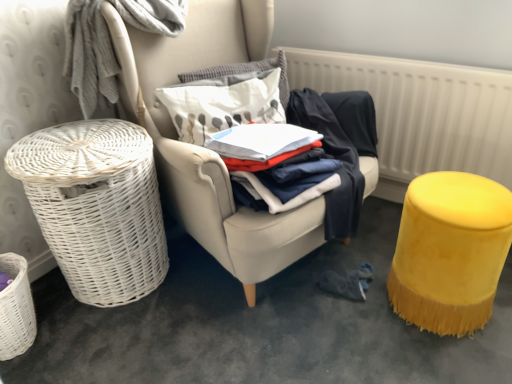
Question: From the image's perspective, does white wicker basket at left appear lower than white fabric pillow at center, arranged as the first pillow when ordered from the bottom?

Choices:
 (A) yes
 (B) no

Answer: (A)

Question: Does white wicker basket at left have a smaller size compared to white fabric pillow at center, arranged as the first pillow when ordered from the bottom?

Choices:
 (A) yes
 (B) no

Answer: (B)

Question: Is white wicker basket at left at the right side of white fabric pillow at center, which is the 2th pillow from top to bottom?

Choices:
 (A) yes
 (B) no

Answer: (A)

Question: Can you confirm if white wicker basket at left is taller than white fabric pillow at center, which is the 2th pillow from top to bottom?

Choices:
 (A) yes
 (B) no

Answer: (A)

Question: Would you say white fabric pillow at center, arranged as the first pillow when ordered from the bottom, is part of white wicker basket at left's contents?

Choices:
 (A) no
 (B) yes

Answer: (B)

Question: From a real-world perspective, is white wicker basket at left located higher than white fabric pillow at center, which is the 2th pillow from top to bottom?

Choices:
 (A) no
 (B) yes

Answer: (A)

Question: Can you confirm if white textured radiator at upper right is smaller than white wicker basket at left?

Choices:
 (A) yes
 (B) no

Answer: (A)

Question: Are white textured radiator at upper right and white wicker basket at left far apart?

Choices:
 (A) yes
 (B) no

Answer: (A)

Question: Is white textured radiator at upper right next to white wicker basket at left and touching it?

Choices:
 (A) no
 (B) yes

Answer: (A)

Question: From the image's perspective, does white textured radiator at upper right appear lower than white wicker basket at left?

Choices:
 (A) no
 (B) yes

Answer: (A)

Question: From a real-world perspective, is white textured radiator at upper right positioned under white wicker basket at left based on gravity?

Choices:
 (A) no
 (B) yes

Answer: (A)

Question: Is white textured radiator at upper right not inside white wicker basket at left?

Choices:
 (A) no
 (B) yes

Answer: (B)

Question: Is white textured pillow at center, which ranks as the first pillow in top-to-bottom order, positioned beyond the bounds of white cotton shirt at center?

Choices:
 (A) no
 (B) yes

Answer: (B)